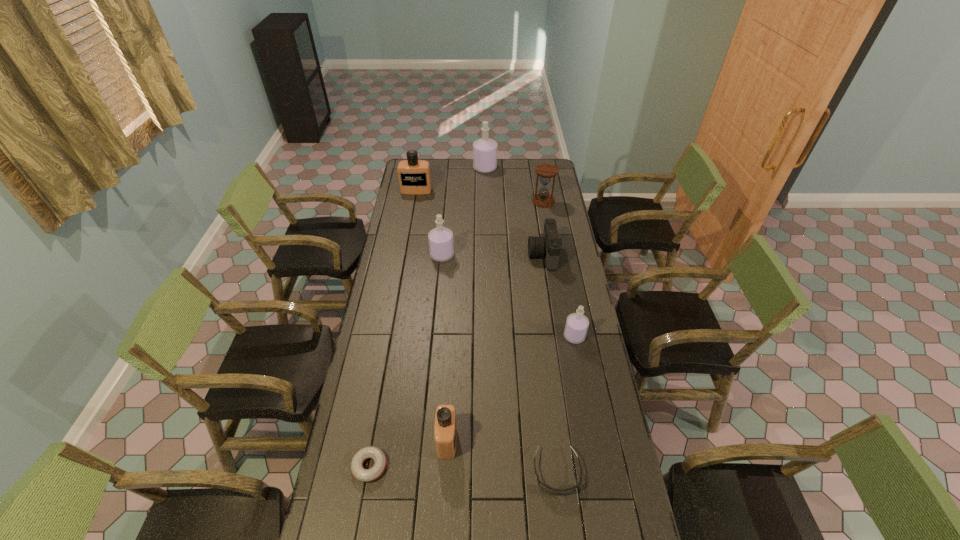
At what (x,y) coordinates should I click in order to perform the action: click on free space that is in between the farthest object and the leftmost purple perfume. Please return your answer as a coordinate pair (x, y). The image size is (960, 540). Looking at the image, I should click on (464, 212).

This screenshot has width=960, height=540. Identify the location of vacant area between the nearer beige perfume and the leftmost purple perfume. (444, 348).

The width and height of the screenshot is (960, 540). Identify the location of blank region between the rightmost perfume and the third shortest object. (559, 296).

Locate an element on the screen. The image size is (960, 540). free spot between the rightmost purple perfume and the second farthest perfume is located at coordinates (495, 264).

This screenshot has height=540, width=960. What are the coordinates of `free space that is in between the hourglass and the right beige perfume` in the screenshot? It's located at (495, 321).

Find the location of `unoccupied area between the shortest object and the camera`. unoccupied area between the shortest object and the camera is located at coordinates (456, 361).

Identify the location of the second closest object to the second shortest object. (576, 327).

The image size is (960, 540). Identify the location of object that can be found as the fifth closest to the nearest perfume. (548, 246).

Identify which perfume is located as the fourth nearest to the leftmost purple perfume. Please provide its 2D coordinates. Your answer should be formatted as a tuple, i.e. [(x, y)], where the tuple contains the x and y coordinates of a point satisfying the conditions above.

[(445, 432)]

Identify the location of perfume that can be found as the fourth closest to the second farthest object. (445, 432).